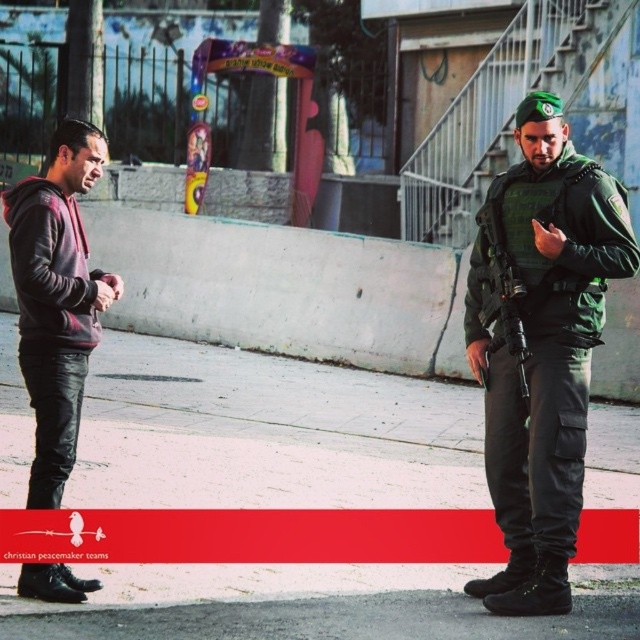
Is point (632, 248) closer to camera compared to point (116, 276)?

Yes, it is.

The width and height of the screenshot is (640, 640). In order to click on green matte uniform at right in this screenshot , I will do `click(540, 346)`.

Who is more forward, (x=566, y=528) or (x=518, y=307)?

Point (x=566, y=528) is more forward.

This screenshot has height=640, width=640. I want to click on green matte uniform at right, so click(x=540, y=346).

Can you confirm if matte black hoodie at left is positioned to the left of matte black rifle at right?

Correct, you'll find matte black hoodie at left to the left of matte black rifle at right.

Can you confirm if matte black hoodie at left is positioned below matte black rifle at right?

Yes.

Does point (28, 264) lie in front of point (490, 259)?

That is True.

What are the coordinates of `matte black hoodie at left` in the screenshot? It's located at (56, 298).